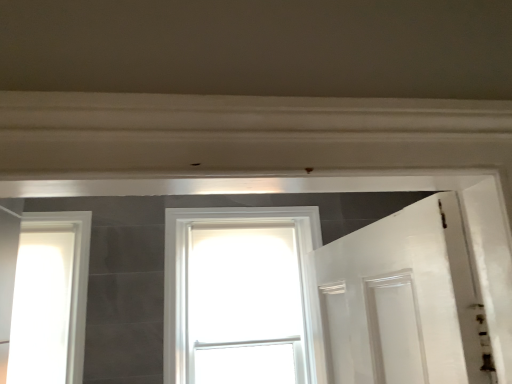
Question: Is white glossy window at center, which appears as the 2th window when viewed from the left, facing towards white glossy window at left, which ranks as the 2th window in right-to-left order?

Choices:
 (A) no
 (B) yes

Answer: (A)

Question: From the image's perspective, would you say white glossy window at center, which appears as the 1th window when viewed from the right, is shown under white glossy window at left, the first window in the left-to-right sequence?

Choices:
 (A) no
 (B) yes

Answer: (B)

Question: Is white glossy window at center, which appears as the 2th window when viewed from the left, shorter than white glossy window at left, which ranks as the 2th window in right-to-left order?

Choices:
 (A) yes
 (B) no

Answer: (B)

Question: Considering the relative positions of white glossy window at center, which appears as the 1th window when viewed from the right, and white glossy window at left, the first window in the left-to-right sequence, in the image provided, is white glossy window at center, which appears as the 1th window when viewed from the right, behind white glossy window at left, the first window in the left-to-right sequence,?

Choices:
 (A) no
 (B) yes

Answer: (B)

Question: Is white glossy window at center, which appears as the 2th window when viewed from the left, positioned beyond the bounds of white glossy window at left, the first window in the left-to-right sequence?

Choices:
 (A) no
 (B) yes

Answer: (B)

Question: Is the depth of white glossy window at center, which appears as the 2th window when viewed from the left, less than that of white glossy window at left, which ranks as the 2th window in right-to-left order?

Choices:
 (A) yes
 (B) no

Answer: (B)

Question: Is white glossy window at left, the first window in the left-to-right sequence, facing away from white glossy window at center, which appears as the 1th window when viewed from the right?

Choices:
 (A) yes
 (B) no

Answer: (B)

Question: Can you confirm if white glossy window at left, the first window in the left-to-right sequence, is smaller than white glossy window at center, which appears as the 2th window when viewed from the left?

Choices:
 (A) no
 (B) yes

Answer: (B)

Question: Does white glossy window at left, which ranks as the 2th window in right-to-left order, come behind white glossy window at center, which appears as the 2th window when viewed from the left?

Choices:
 (A) no
 (B) yes

Answer: (A)

Question: Is white glossy window at left, which ranks as the 2th window in right-to-left order, wider than white glossy window at center, which appears as the 2th window when viewed from the left?

Choices:
 (A) no
 (B) yes

Answer: (A)

Question: Is white glossy window at left, the first window in the left-to-right sequence, oriented towards white glossy window at center, which appears as the 2th window when viewed from the left?

Choices:
 (A) no
 (B) yes

Answer: (A)

Question: Does white glossy window at left, the first window in the left-to-right sequence, appear on the left side of white glossy window at center, which appears as the 1th window when viewed from the right?

Choices:
 (A) no
 (B) yes

Answer: (B)

Question: In terms of size, does white glossy window at center, which appears as the 1th window when viewed from the right, appear bigger or smaller than white glossy window at left, which ranks as the 2th window in right-to-left order?

Choices:
 (A) small
 (B) big

Answer: (B)